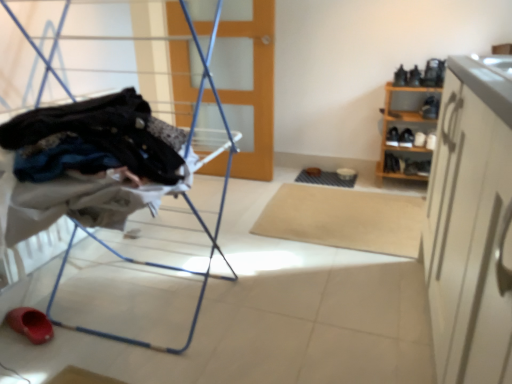
Question: Should I look upward or downward to see wooden at center?

Choices:
 (A) up
 (B) down

Answer: (A)

Question: Considering the relative sizes of beige carpet at center and metal laundry rack at left in the image provided, is beige carpet at center shorter than metal laundry rack at left?

Choices:
 (A) yes
 (B) no

Answer: (A)

Question: Does beige carpet at center have a larger size compared to metal laundry rack at left?

Choices:
 (A) no
 (B) yes

Answer: (A)

Question: Is beige carpet at center to the left of metal laundry rack at left from the viewer's perspective?

Choices:
 (A) no
 (B) yes

Answer: (A)

Question: Is beige carpet at center facing away from metal laundry rack at left?

Choices:
 (A) no
 (B) yes

Answer: (A)

Question: From a real-world perspective, is beige carpet at center positioned under metal laundry rack at left based on gravity?

Choices:
 (A) no
 (B) yes

Answer: (B)

Question: Considering the relative sizes of beige carpet at center and metal laundry rack at left in the image provided, is beige carpet at center wider than metal laundry rack at left?

Choices:
 (A) no
 (B) yes

Answer: (B)

Question: Considering the relative positions of beige carpet at center and wooden at center in the image provided, is beige carpet at center behind wooden at center?

Choices:
 (A) yes
 (B) no

Answer: (B)

Question: From the image's perspective, would you say beige carpet at center is positioned over wooden at center?

Choices:
 (A) yes
 (B) no

Answer: (B)

Question: Does beige carpet at center come in front of wooden at center?

Choices:
 (A) no
 (B) yes

Answer: (B)

Question: Is beige carpet at center taller than wooden at center?

Choices:
 (A) yes
 (B) no

Answer: (B)

Question: Does beige carpet at center turn towards wooden at center?

Choices:
 (A) yes
 (B) no

Answer: (B)

Question: From a real-world perspective, is beige carpet at center located higher than wooden at center?

Choices:
 (A) no
 (B) yes

Answer: (A)

Question: Can you confirm if wooden shoe rack at right is wider than metal laundry rack at left?

Choices:
 (A) no
 (B) yes

Answer: (A)